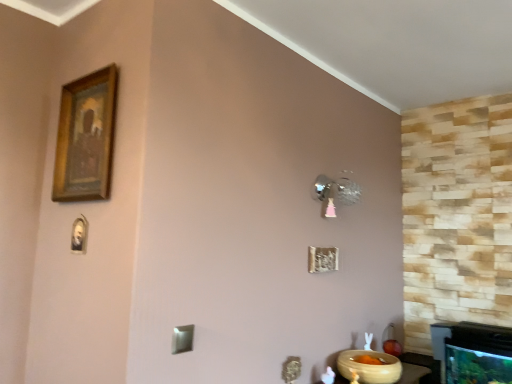
Question: Based on their sizes in the image, would you say gold wooden picture frame at upper left is bigger or smaller than beige glossy bowl at lower right?

Choices:
 (A) small
 (B) big

Answer: (A)

Question: Based on their positions, is gold wooden picture frame at upper left located to the left or right of beige glossy bowl at lower right?

Choices:
 (A) right
 (B) left

Answer: (B)

Question: Considering the positions of gold wooden picture frame at upper left and beige glossy bowl at lower right in the image, is gold wooden picture frame at upper left taller or shorter than beige glossy bowl at lower right?

Choices:
 (A) short
 (B) tall

Answer: (B)

Question: Is beige glossy bowl at lower right in front of or behind gold wooden picture frame at upper left in the image?

Choices:
 (A) front
 (B) behind

Answer: (B)

Question: Is beige glossy bowl at lower right bigger or smaller than gold wooden picture frame at upper left?

Choices:
 (A) big
 (B) small

Answer: (A)

Question: Is beige glossy bowl at lower right inside or outside of gold wooden picture frame at upper left?

Choices:
 (A) outside
 (B) inside

Answer: (A)

Question: From a real-world perspective, is beige glossy bowl at lower right above or below gold wooden picture frame at upper left?

Choices:
 (A) above
 (B) below

Answer: (B)